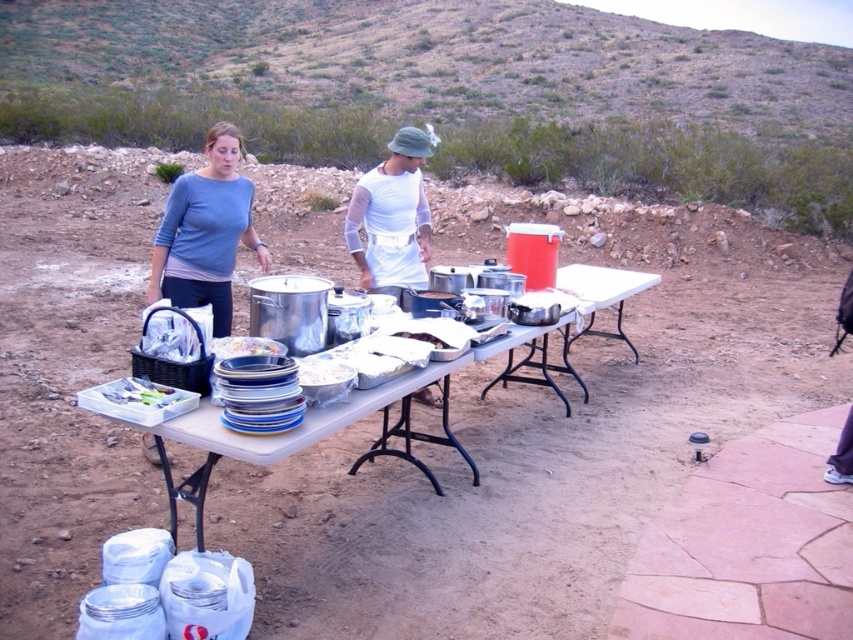
You are setting up a picnic in the desert and have a clear plastic container at lower left and a white plastic plate at center. Which item has a greater width?

The clear plastic container at lower left has a greater width than the white plastic plate at center.

You are a chef preparing a meal and need to place a garnish on the white plastic plate at center. The garnish is currently in the clear plastic container at lower left. Can you reach the plate without moving the container?

The clear plastic container at lower left is 33.35 centimeters away from white plastic plate at center. Since the distance is over 30 centimeters, you cannot reach the plate without moving the container.